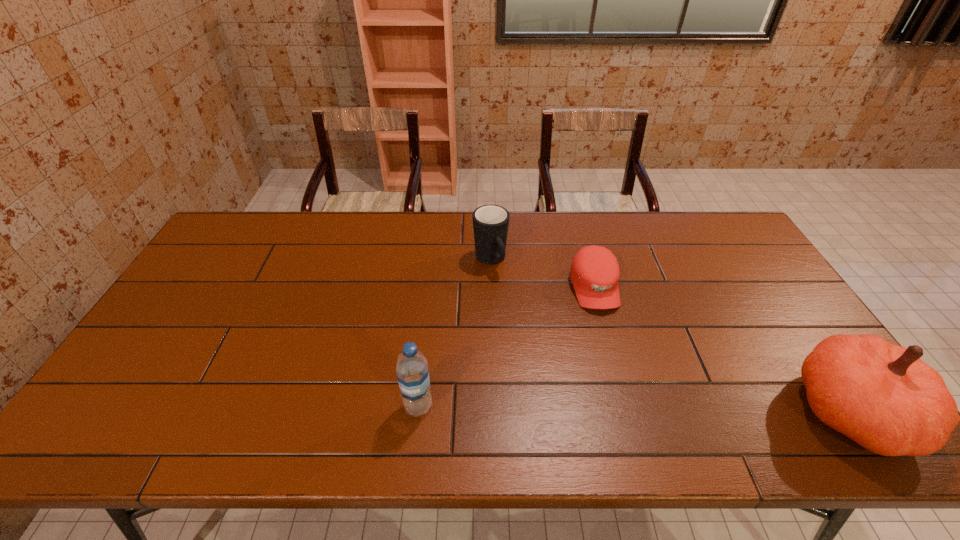
You are a GUI agent. You are given a task and a screenshot of the screen. Output one action in this format:
    pyautogui.click(x=<x>, y=<y>)
    Task: Click on the vacant space at the far edge of the desktop
    This screenshot has height=540, width=960.
    Given the screenshot: What is the action you would take?
    pyautogui.click(x=397, y=212)

You are a GUI agent. You are given a task and a screenshot of the screen. Output one action in this format:
    pyautogui.click(x=<x>, y=<y>)
    Task: Click on the blank space at the near edge of the desktop
    
    Given the screenshot: What is the action you would take?
    pyautogui.click(x=351, y=391)

The width and height of the screenshot is (960, 540). I want to click on vacant space at the left edge, so click(x=239, y=271).

This screenshot has width=960, height=540. In the image, there is a desktop. What are the coordinates of `vacant area at the right edge` in the screenshot? It's located at point(732,300).

You are a GUI agent. You are given a task and a screenshot of the screen. Output one action in this format:
    pyautogui.click(x=<x>, y=<y>)
    Task: Click on the vacant point at the far right corner
    The width and height of the screenshot is (960, 540).
    Given the screenshot: What is the action you would take?
    coord(745,246)

The image size is (960, 540). What are the coordinates of `free space at the near right corner of the desktop` in the screenshot? It's located at click(x=793, y=387).

Identify the location of blank region between the cap and the second object from left to right. click(542, 274).

Where is `vacant space that is in between the mug and the cap`? This screenshot has height=540, width=960. vacant space that is in between the mug and the cap is located at coordinates (542, 274).

This screenshot has width=960, height=540. Identify the location of vacant area that lies between the rightmost object and the second object from right to left. (724, 349).

Locate an element on the screen. This screenshot has width=960, height=540. blank region between the mug and the second object from right to left is located at coordinates point(542,274).